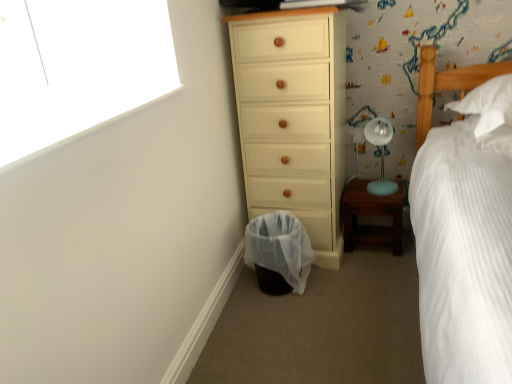
Question: In the image, is wooden nightstand at lower right on the left side or the right side of translucent plastic laundry basket at lower center?

Choices:
 (A) right
 (B) left

Answer: (A)

Question: Is wooden nightstand at lower right spatially inside translucent plastic laundry basket at lower center, or outside of it?

Choices:
 (A) outside
 (B) inside

Answer: (A)

Question: Estimate the real-world distances between objects in this image. Which object is farther from the light blue plastic table lamp at right?

Choices:
 (A) translucent plastic laundry basket at lower center
 (B) matte cream chest of drawers at center
 (C) white textured bed at right
 (D) wooden nightstand at lower right

Answer: (A)

Question: Considering the real-world distances, which object is closest to the light blue plastic table lamp at right?

Choices:
 (A) translucent plastic laundry basket at lower center
 (B) matte cream chest of drawers at center
 (C) white textured bed at right
 (D) wooden nightstand at lower right

Answer: (C)